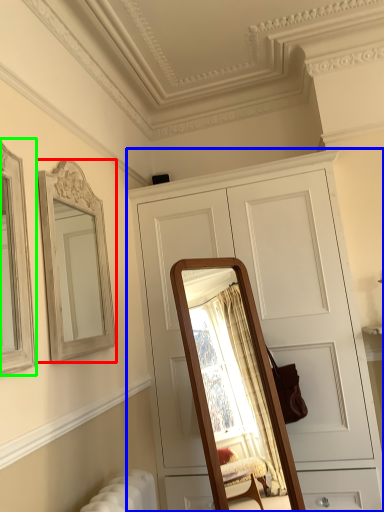
Question: Considering the real-world distances, which object is closest to mirror (highlighted by a red box)? cabinetry (highlighted by a blue box) or picture frame (highlighted by a green box).

Choices:
 (A) cabinetry
 (B) picture frame

Answer: (B)